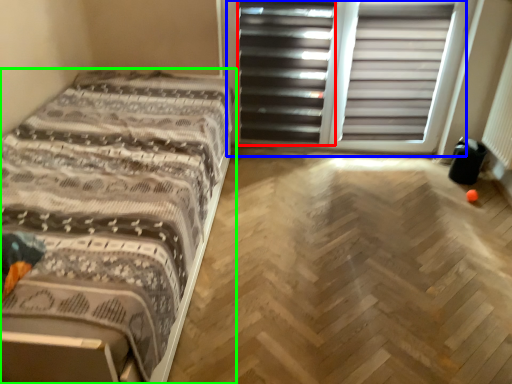
Question: Which object is positioned closest to screen door (highlighted by a red box)? Select from screen door (highlighted by a blue box) and bed (highlighted by a green box).

Choices:
 (A) screen door
 (B) bed

Answer: (A)